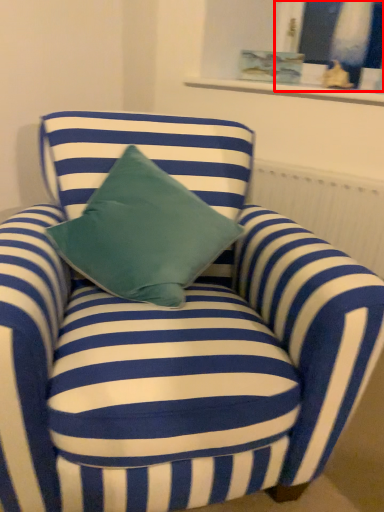
Question: In this image, where is window (annotated by the red box) located relative to radiator?

Choices:
 (A) right
 (B) left

Answer: (A)